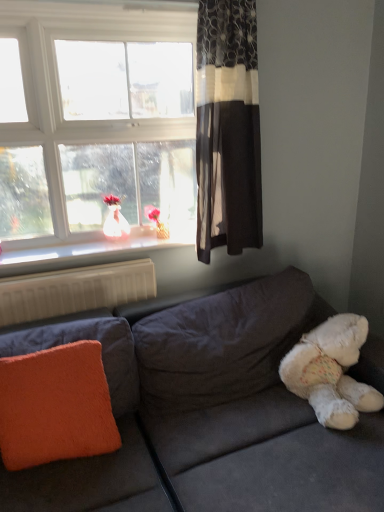
Question: Can we say dark floral-patterned curtain at upper right lies outside white fluffy teddy bear at lower right?

Choices:
 (A) no
 (B) yes

Answer: (B)

Question: From a real-world perspective, is dark floral-patterned curtain at upper right located beneath white fluffy teddy bear at lower right?

Choices:
 (A) yes
 (B) no

Answer: (B)

Question: Is dark floral-patterned curtain at upper right oriented away from white fluffy teddy bear at lower right?

Choices:
 (A) yes
 (B) no

Answer: (B)

Question: Considering the relative sizes of dark floral-patterned curtain at upper right and white fluffy teddy bear at lower right in the image provided, is dark floral-patterned curtain at upper right thinner than white fluffy teddy bear at lower right?

Choices:
 (A) yes
 (B) no

Answer: (A)

Question: Is dark floral-patterned curtain at upper right facing towards white fluffy teddy bear at lower right?

Choices:
 (A) no
 (B) yes

Answer: (B)

Question: Is dark floral-patterned curtain at upper right smaller than white fluffy teddy bear at lower right?

Choices:
 (A) no
 (B) yes

Answer: (A)

Question: Is velvet gray couch at lower right positioned before white plastic radiator at lower left?

Choices:
 (A) yes
 (B) no

Answer: (A)

Question: Is velvet gray couch at lower right taller than white plastic radiator at lower left?

Choices:
 (A) no
 (B) yes

Answer: (B)

Question: Is velvet gray couch at lower right facing away from white plastic radiator at lower left?

Choices:
 (A) no
 (B) yes

Answer: (A)

Question: From a real-world perspective, is velvet gray couch at lower right under white plastic radiator at lower left?

Choices:
 (A) no
 (B) yes

Answer: (B)

Question: Does velvet gray couch at lower right have a smaller size compared to white plastic radiator at lower left?

Choices:
 (A) no
 (B) yes

Answer: (A)

Question: Does velvet gray couch at lower right have a greater width compared to white plastic radiator at lower left?

Choices:
 (A) no
 (B) yes

Answer: (B)

Question: Considering the relative sizes of dark floral-patterned curtain at upper right and white plastic radiator at lower left in the image provided, is dark floral-patterned curtain at upper right taller than white plastic radiator at lower left?

Choices:
 (A) no
 (B) yes

Answer: (B)